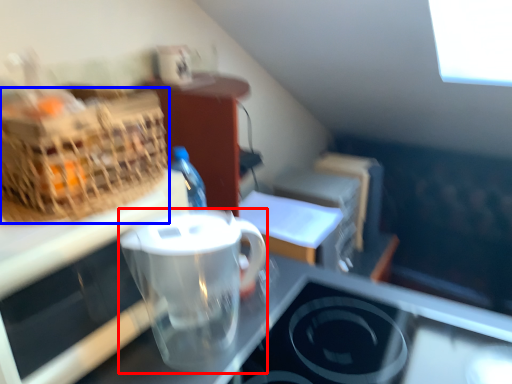
Question: Among these objects, which one is nearest to the camera, coffee cup (highlighted by a red box) or picnic basket (highlighted by a blue box)?

Choices:
 (A) coffee cup
 (B) picnic basket

Answer: (B)